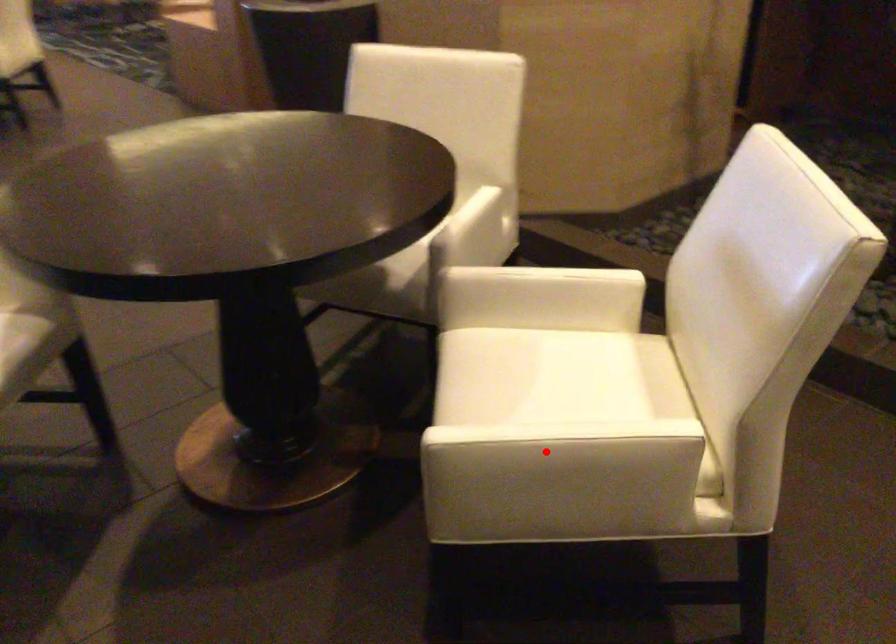
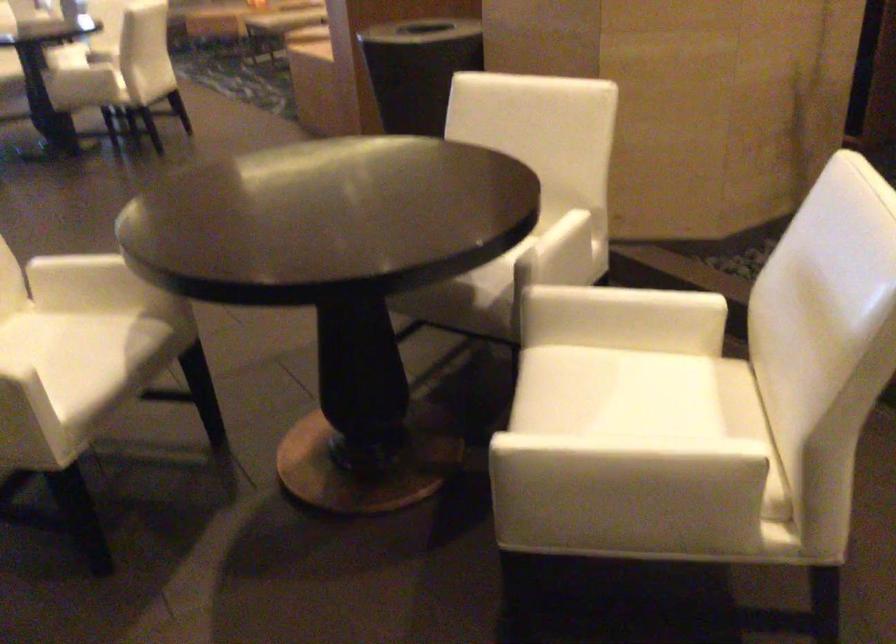
In the second image, find the point that corresponds to the highlighted location in the first image.

(607, 462)